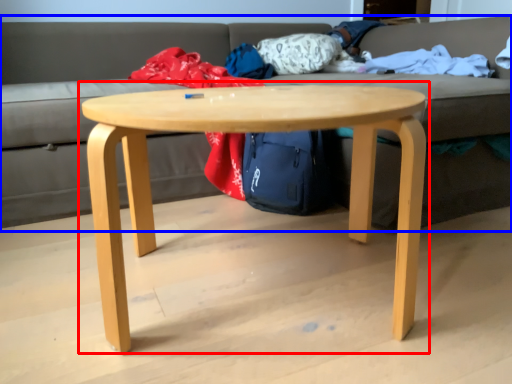
Question: Which object appears closest to the camera in this image, coffee table (highlighted by a red box) or studio couch (highlighted by a blue box)?

Choices:
 (A) coffee table
 (B) studio couch

Answer: (A)